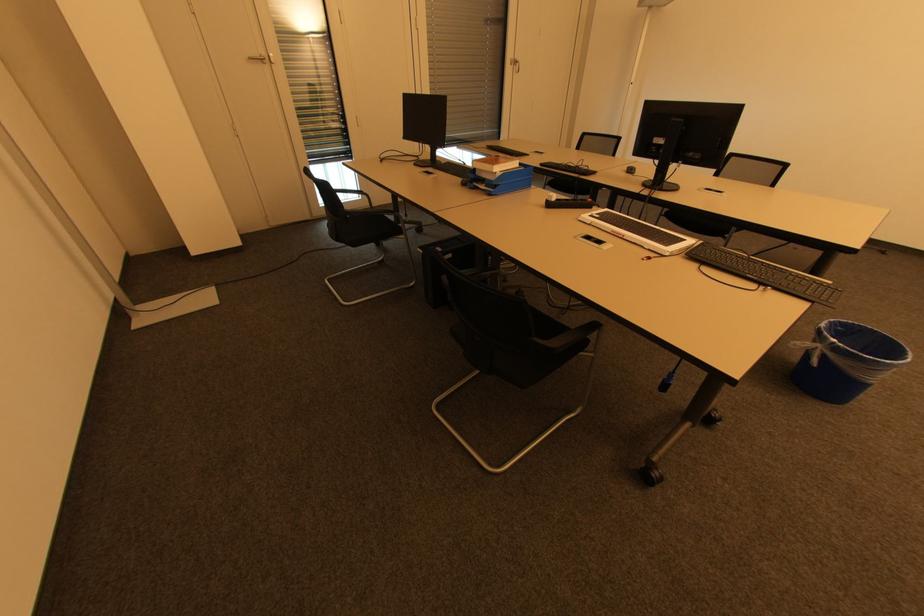
The height and width of the screenshot is (616, 924). What do you see at coordinates (525, 323) in the screenshot?
I see `the black chair sitting surface` at bounding box center [525, 323].